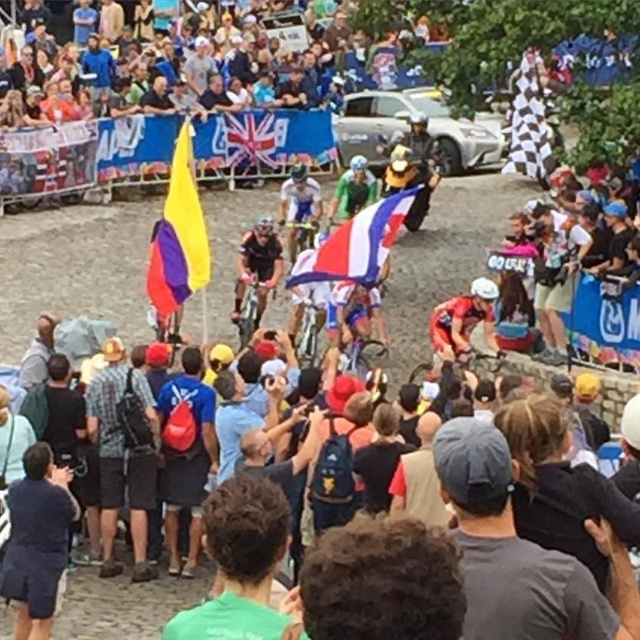
In the scene shown: Is dark curly hair at center positioned behind checkered fabric flag at upper right?

No.

Does dark curly hair at center appear under checkered fabric flag at upper right?

Yes.

Locate an element on the screen. The image size is (640, 640). dark curly hair at center is located at coordinates (381, 582).

Between blue and white striped flag at center and white matte bicycle at center, which one has more height?

Standing taller between the two is white matte bicycle at center.

Where is `blue and white striped flag at center`? This screenshot has height=640, width=640. blue and white striped flag at center is located at coordinates (358, 243).

This screenshot has height=640, width=640. I want to click on blue and white striped flag at center, so click(x=358, y=243).

Is checkered fabric flag at upper right smaller than white matte bicycle at center?

Actually, checkered fabric flag at upper right might be larger than white matte bicycle at center.

Which is below, checkered fabric flag at upper right or white matte bicycle at center?

white matte bicycle at center is lower down.

The width and height of the screenshot is (640, 640). Find the location of `checkered fabric flag at upper right`. checkered fabric flag at upper right is located at coordinates (529, 122).

You are a GUI agent. You are given a task and a screenshot of the screen. Output one action in this format:
    pyautogui.click(x=<x>, y=<y>)
    Task: Click on the checkered fabric flag at upper right
    This screenshot has height=640, width=640.
    Given the screenshot: What is the action you would take?
    pyautogui.click(x=529, y=122)